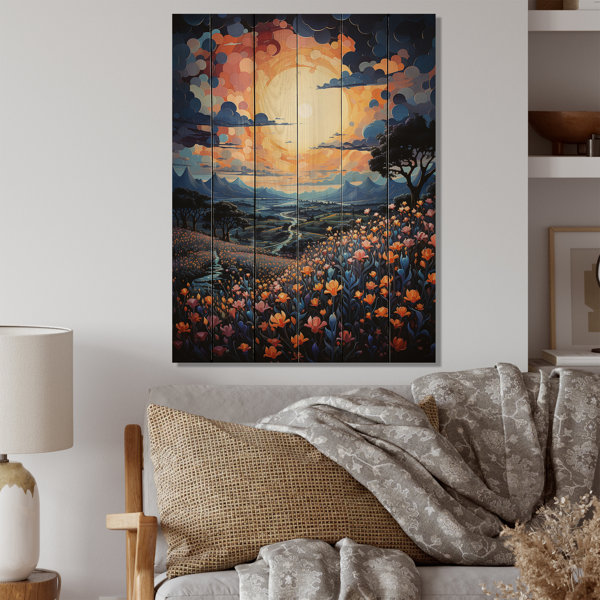
What are the coordinates of `front edge of shelves` in the screenshot? It's located at (578, 17), (582, 172).